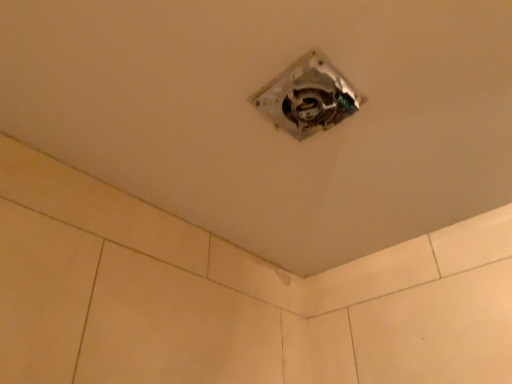
Find the location of a particular element. metallic silver power plugs and sockets at upper center is located at coordinates (308, 97).

This screenshot has width=512, height=384. Describe the element at coordinates (308, 97) in the screenshot. I see `metallic silver power plugs and sockets at upper center` at that location.

The height and width of the screenshot is (384, 512). Identify the location of metallic silver power plugs and sockets at upper center. (308, 97).